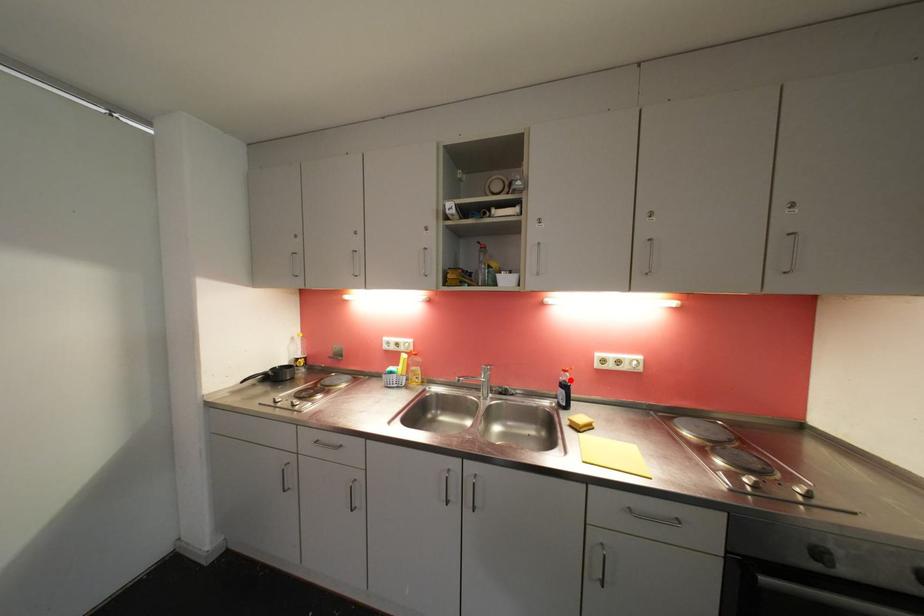
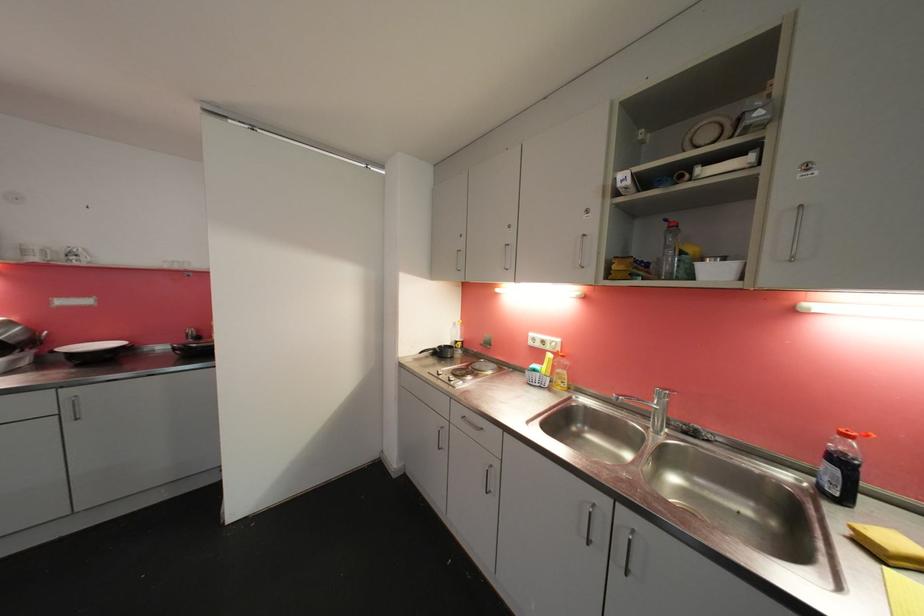
Where in the second image is the point corresponding to the highlighted location from the first image?

(850, 450)